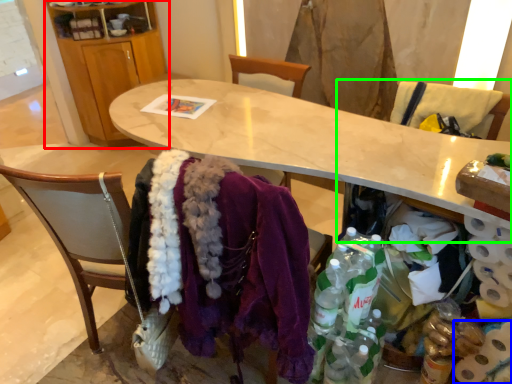
Question: Which object is the closest to the cabinetry (highlighted by a red box)? Choose among these: toilet paper (highlighted by a blue box) or armchair (highlighted by a green box).

Choices:
 (A) toilet paper
 (B) armchair

Answer: (B)